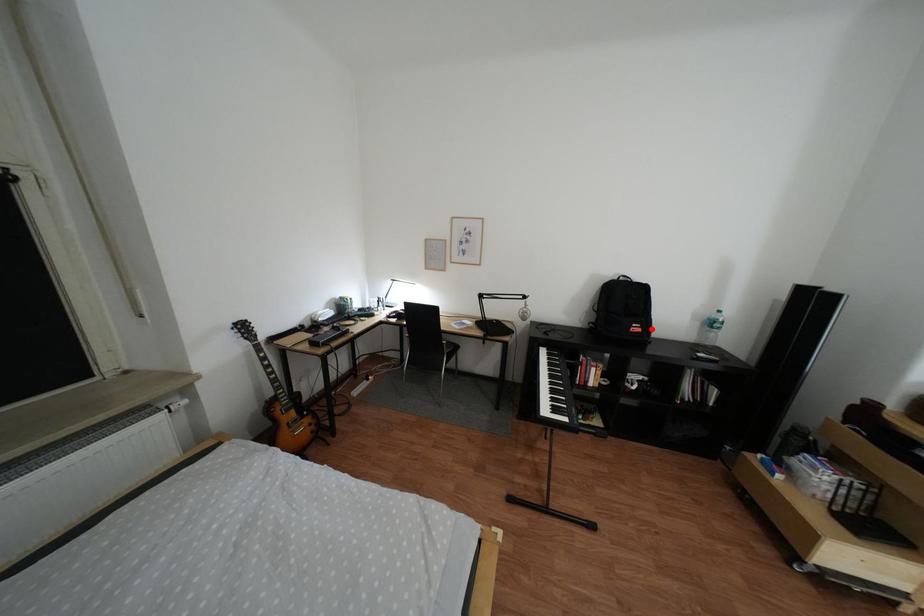
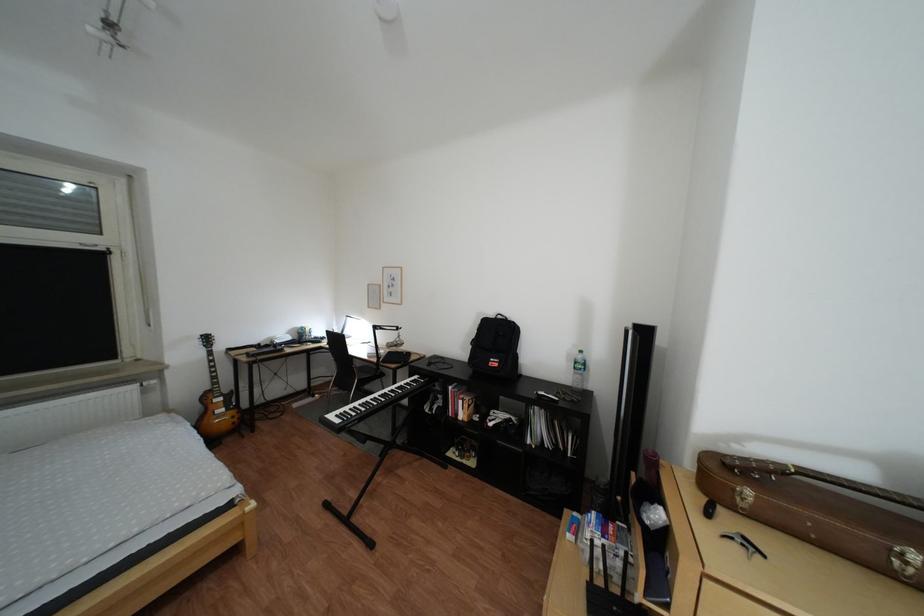
Find the pixel in the second image that matches the highlighted location in the first image.

(509, 363)